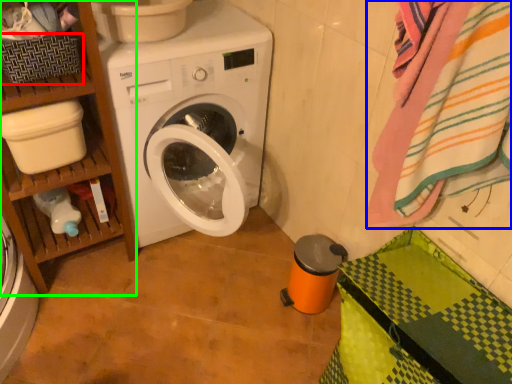
Question: Estimate the real-world distances between objects in this image. Which object is closer to basket (highlighted by a red box), bath towel (highlighted by a blue box) or shelf (highlighted by a green box)?

Choices:
 (A) bath towel
 (B) shelf

Answer: (B)